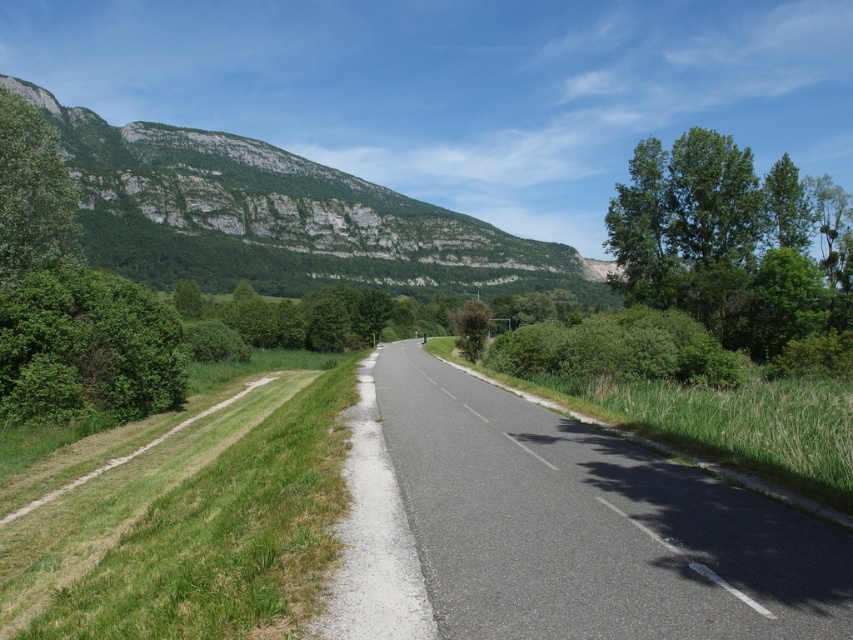
You are a drone operator trying to capture aerial footage of the two points mentioned in the scene. The first point is at coordinates point (125, 136) and the second is at point (56, 388). From the perspective of someone standing at the starting point of the road, which point is closer to the camera?

Point (56, 388) is closer to the camera because it is in front of point (125, 136), which is behind it.